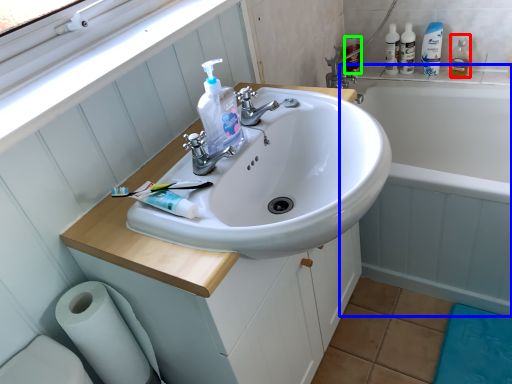
Question: Considering the real-world distances, which object is farthest from mouthwash (highlighted by a red box)? bath (highlighted by a blue box) or cleaning product (highlighted by a green box)?

Choices:
 (A) bath
 (B) cleaning product

Answer: (A)